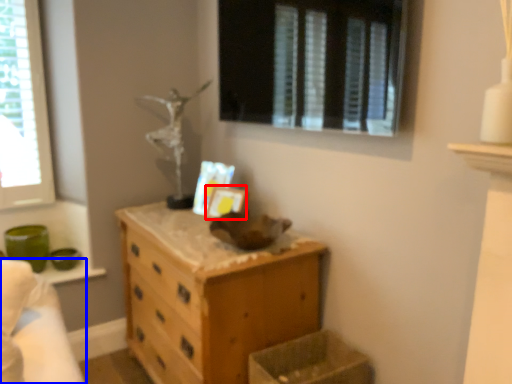
Question: Which object appears farthest to the camera in this image, picture frame (highlighted by a red box) or bed (highlighted by a blue box)?

Choices:
 (A) picture frame
 (B) bed

Answer: (A)